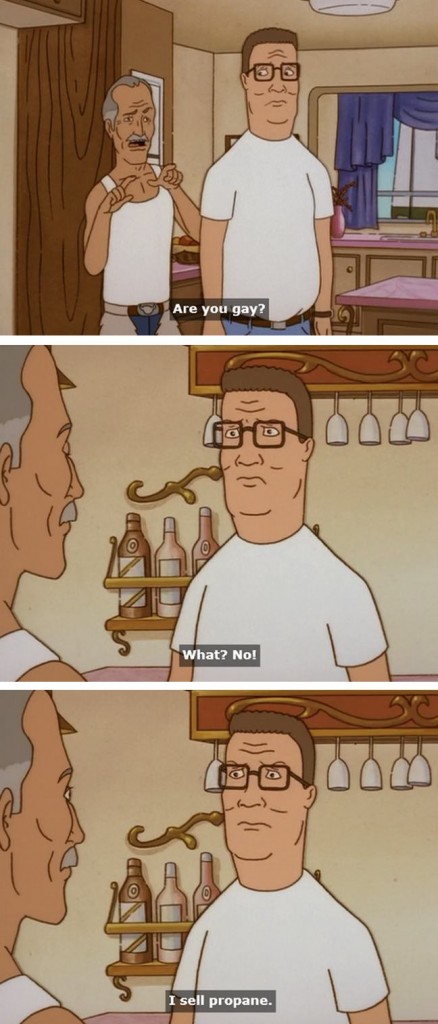
This screenshot has height=1024, width=438. In order to click on wine glasses in this screenshot , I will do point(209,776), point(335,770), point(369,771), point(397,772), point(417,768), point(210,426), point(337,434), point(369,426), point(393,426), point(408,430).